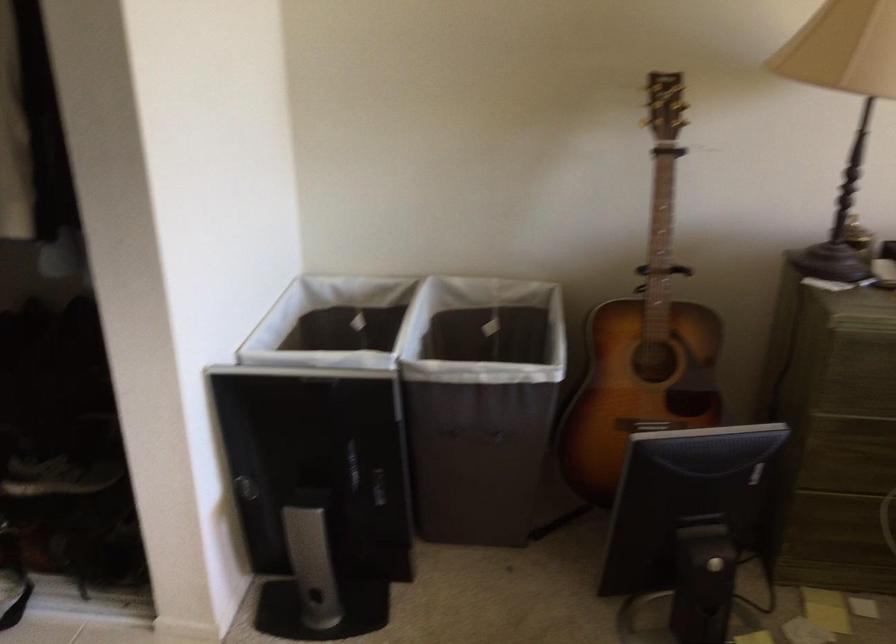
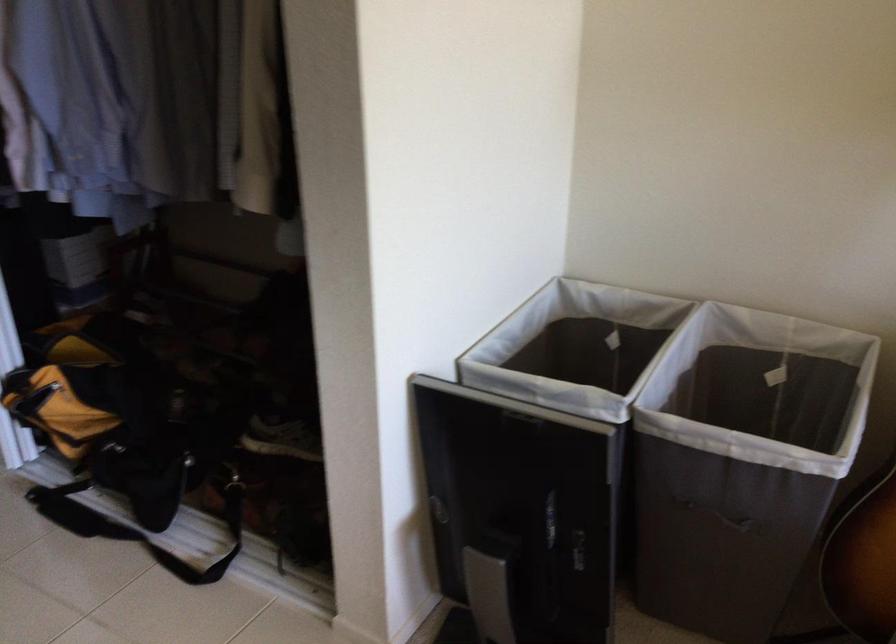
The point at (488, 392) is marked in the first image. Where is the corresponding point in the second image?

(742, 462)